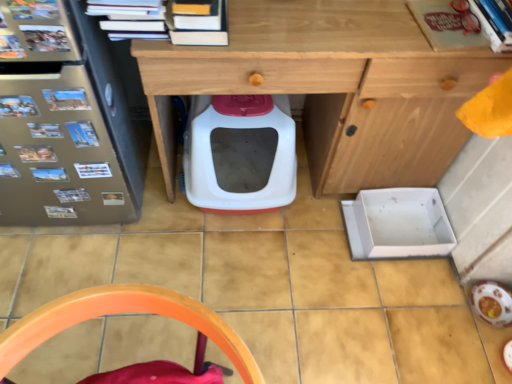
What are the coordinates of `vacant space in front of metallic silver fridge at left` in the screenshot? It's located at (73, 279).